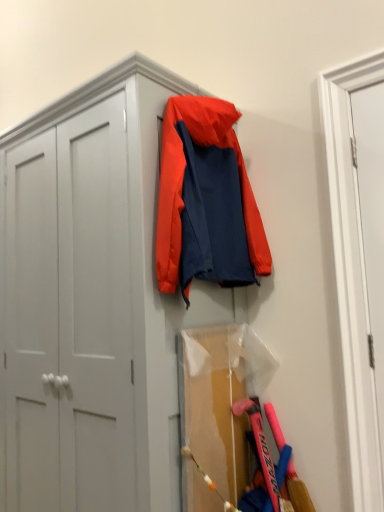
Question: From the image's perspective, is white matte door at right, positioned as the first door in left-to-right order, positioned above or below white smooth door at right, acting as the 2th door starting from the left?

Choices:
 (A) below
 (B) above

Answer: (B)

Question: From their relative heights in the image, would you say white matte door at right, positioned as the first door in left-to-right order, is taller or shorter than white smooth door at right, which ranks as the first door in right-to-left order?

Choices:
 (A) tall
 (B) short

Answer: (A)

Question: Which object is the closest to the white smooth door at right, which ranks as the first door in right-to-left order?

Choices:
 (A) matte white cabinet at upper left
 (B) white matte door at right, which is the second door from right to left
 (C) orange fabric jacket at center

Answer: (B)

Question: Based on their relative distances, which object is nearer to the white matte door at right, positioned as the first door in left-to-right order?

Choices:
 (A) matte white cabinet at upper left
 (B) orange fabric jacket at center
 (C) white smooth door at right, which ranks as the first door in right-to-left order

Answer: (C)